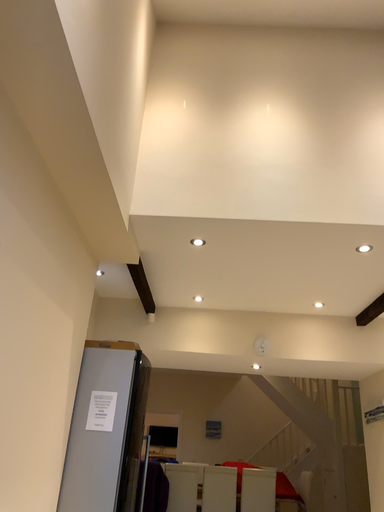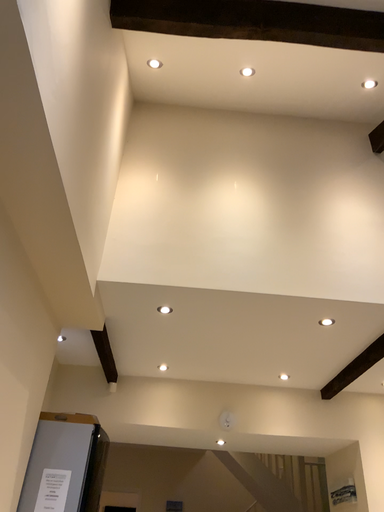
Question: How did the camera likely rotate when shooting the video?

Choices:
 (A) rotated upward
 (B) rotated downward

Answer: (A)